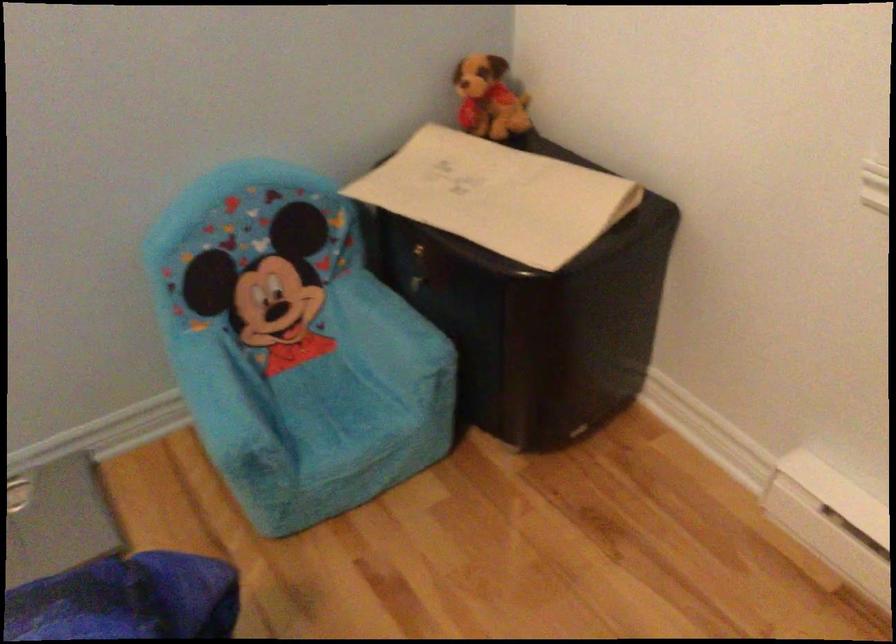
Find where to lift the paper folder. Please return your answer as a coordinate pair (x, y).

(497, 196)